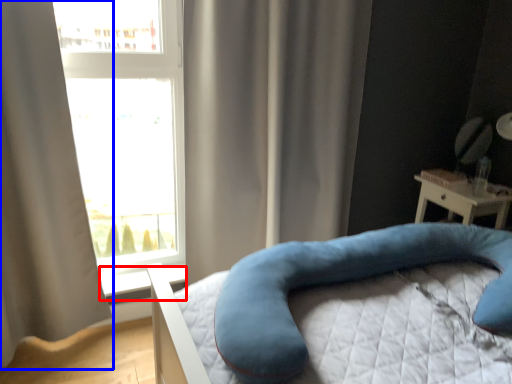
Question: Which object is closer to the camera taking this photo, window sill (highlighted by a red box) or curtain (highlighted by a blue box)?

Choices:
 (A) window sill
 (B) curtain

Answer: (B)